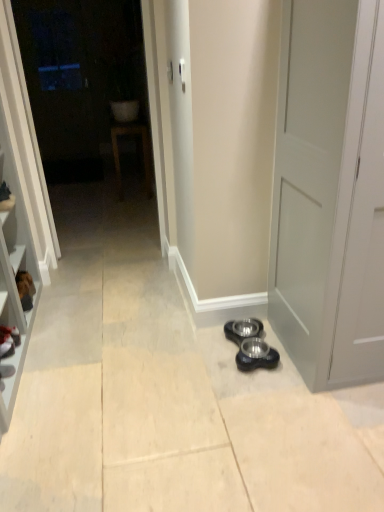
Where is `matte white sink at upper center`? Image resolution: width=384 pixels, height=512 pixels. matte white sink at upper center is located at coordinates (128, 136).

Image resolution: width=384 pixels, height=512 pixels. In order to click on black leather shoe at left in this screenshot , I will do `click(8, 341)`.

You are a GUI agent. You are given a task and a screenshot of the screen. Output one action in this format:
    pyautogui.click(x=<x>, y=<y>)
    Task: Click on the transparent glass door at upper left
    This screenshot has width=384, height=512.
    Given the screenshot: What is the action you would take?
    pyautogui.click(x=84, y=83)

From a real-world perspective, which is physically above, transparent glass door at upper left or matte white sink at upper center?

transparent glass door at upper left is physically above.

Which of these two, transparent glass door at upper left or matte white sink at upper center, is smaller?

Smaller between the two is transparent glass door at upper left.

In order to click on sink to the left of transparent glass door at upper left in this screenshot , I will do `click(128, 136)`.

Where is `footwear in front of the matte white sink at upper center`? The width and height of the screenshot is (384, 512). footwear in front of the matte white sink at upper center is located at coordinates (8, 341).

Could you tell me if matte white sink at upper center is turned towards black leather shoe at left?

No, matte white sink at upper center is not facing towards black leather shoe at left.

Is matte white sink at upper center surrounding black leather shoe at left?

That's incorrect, black leather shoe at left is not inside matte white sink at upper center.

From a real-world perspective, is matte white sink at upper center positioned above or below black leather shoe at left?

matte white sink at upper center is situated higher than black leather shoe at left in the real world.

From a real-world perspective, who is located lower, transparent glass door at upper left or satin silver door handle at upper center?

From a 3D spatial view, transparent glass door at upper left is below.

From their relative heights in the image, would you say transparent glass door at upper left is taller or shorter than satin silver door handle at upper center?

transparent glass door at upper left is taller than satin silver door handle at upper center.

Where is `door handle on the right of transparent glass door at upper left`? Image resolution: width=384 pixels, height=512 pixels. door handle on the right of transparent glass door at upper left is located at coordinates (170, 71).

You are a GUI agent. You are given a task and a screenshot of the screen. Output one action in this format:
    pyautogui.click(x=<x>, y=<y>)
    Task: Click on the glass door below the satin silver door handle at upper center (from the image's perspective)
    Image resolution: width=384 pixels, height=512 pixels.
    Given the screenshot: What is the action you would take?
    pyautogui.click(x=84, y=83)

Are satin silver door handle at upper center and transparent glass door at upper left located far from each other?

satin silver door handle at upper center is positioned a significant distance from transparent glass door at upper left.

From their relative heights in the image, would you say satin silver door handle at upper center is taller or shorter than transparent glass door at upper left?

Clearly, satin silver door handle at upper center is shorter compared to transparent glass door at upper left.

Visually, is satin silver door handle at upper center positioned to the left or to the right of transparent glass door at upper left?

satin silver door handle at upper center is positioned on transparent glass door at upper left's right side.

From the image's perspective, is matte white sink at upper center positioned above or below satin silver door handle at upper center?

Clearly, from the image's perspective, matte white sink at upper center is above satin silver door handle at upper center.

Is point (142, 143) positioned before point (169, 74)?

No.

Is matte white sink at upper center further to camera compared to satin silver door handle at upper center?

That is True.

Is matte white sink at upper center placed right next to satin silver door handle at upper center?

matte white sink at upper center and satin silver door handle at upper center are clearly separated.

From a real-world perspective, is matte white sink at upper center physically located above or below black rubber bowls at lower center?

matte white sink at upper center is above black rubber bowls at lower center.

Between matte white sink at upper center and black rubber bowls at lower center, which one has smaller size?

With smaller size is black rubber bowls at lower center.

Is point (148, 185) in front of point (250, 351)?

No.

From the image's perspective, which one is positioned lower, matte white sink at upper center or black rubber bowls at lower center?

black rubber bowls at lower center.

What are the coordinates of `footwear below the matte white sink at upper center (from the image's perspective)` in the screenshot? It's located at (8, 341).

Can you confirm if black leather shoe at left is wider than matte white sink at upper center?

Incorrect, the width of black leather shoe at left does not surpass that of matte white sink at upper center.

Is black leather shoe at left inside the boundaries of matte white sink at upper center, or outside?

black leather shoe at left is located beyond the bounds of matte white sink at upper center.

Locate an element on the screen. sink above the transparent glass door at upper left (from the image's perspective) is located at coordinates (128, 136).

This screenshot has height=512, width=384. I want to click on sink that is behind the black leather shoe at left, so click(128, 136).

From the image, which object appears to be farther from matte white sink at upper center, transparent glass door at upper left or black rubber bowls at lower center?

Based on the image, black rubber bowls at lower center appears to be further to matte white sink at upper center.

Looking at the image, which one is located closer to satin silver door handle at upper center, transparent glass door at upper left or matte white sink at upper center?

Based on the image, matte white sink at upper center appears to be nearer to satin silver door handle at upper center.

Looking at the image, which one is located closer to transparent glass door at upper left, matte white sink at upper center or black leather shoe at left?

Based on the image, matte white sink at upper center appears to be nearer to transparent glass door at upper left.

Based on their spatial positions, is black rubber bowls at lower center or black leather shoe at left closer to transparent glass door at upper left?

black leather shoe at left.

Considering their positions, is satin silver door handle at upper center positioned closer to matte white sink at upper center than black rubber bowls at lower center?

Based on the image, satin silver door handle at upper center appears to be nearer to matte white sink at upper center.

Estimate the real-world distances between objects in this image. Which object is further from matte white sink at upper center, black rubber bowls at lower center or black leather shoe at left?

black rubber bowls at lower center is positioned further to the anchor matte white sink at upper center.

Based on their spatial positions, is black leather shoe at left or matte white sink at upper center further from transparent glass door at upper left?

The object further to transparent glass door at upper left is black leather shoe at left.

Estimate the real-world distances between objects in this image. Which object is further from black leather shoe at left, black rubber bowls at lower center or matte white sink at upper center?

Among the two, matte white sink at upper center is located further to black leather shoe at left.

Locate an element on the screen. The width and height of the screenshot is (384, 512). footwear between transparent glass door at upper left and black rubber bowls at lower center vertically is located at coordinates (8, 341).

Locate an element on the screen. Image resolution: width=384 pixels, height=512 pixels. glass door between black rubber bowls at lower center and matte white sink at upper center along the z-axis is located at coordinates (84, 83).

I want to click on footwear between black rubber bowls at lower center and matte white sink at upper center from front to back, so click(8, 341).

Image resolution: width=384 pixels, height=512 pixels. Identify the location of glass door between satin silver door handle at upper center and black leather shoe at left in the up-down direction. tap(84, 83).